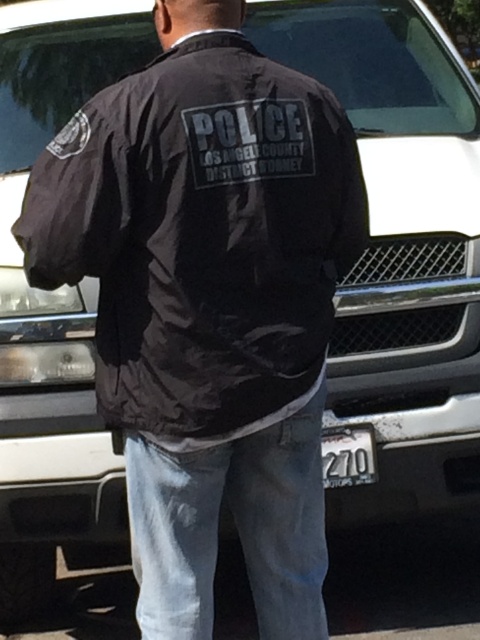
Question: Does black nylon jacket at center come behind white plastic license plate at lower center?

Choices:
 (A) no
 (B) yes

Answer: (A)

Question: Among these objects, which one is farthest from the camera?

Choices:
 (A) white plastic license plate at lower center
 (B) black nylon jacket at center

Answer: (A)

Question: Is black nylon jacket at center above white plastic license plate at lower center?

Choices:
 (A) yes
 (B) no

Answer: (A)

Question: Can you confirm if black nylon jacket at center is wider than white plastic license plate at lower center?

Choices:
 (A) yes
 (B) no

Answer: (A)